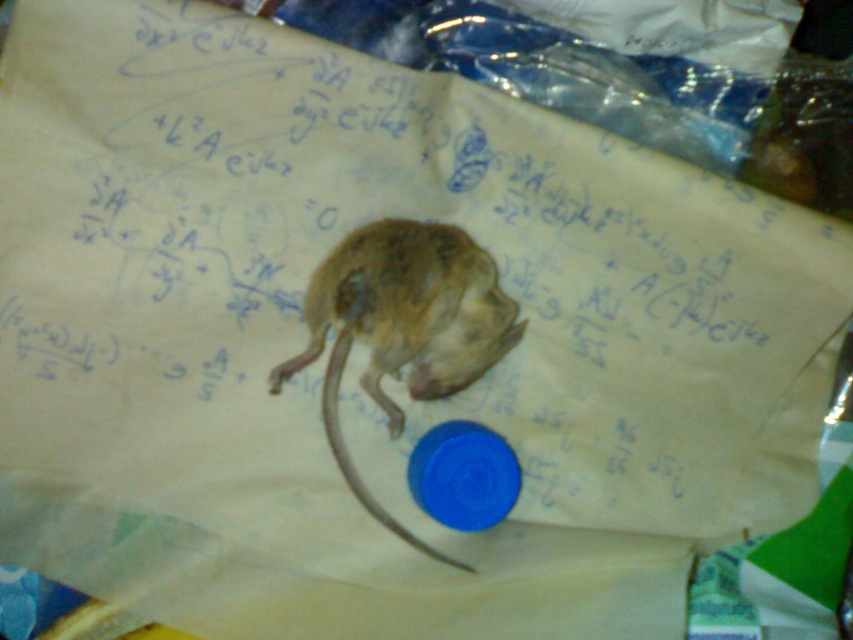
Between fuzzy brown mouse at center and brown fur tail at center, which one is positioned higher?

fuzzy brown mouse at center is above.

Which is in front, point (437, 387) or point (343, 342)?

Point (343, 342)

Where is `fuzzy brown mouse at center`? fuzzy brown mouse at center is located at coordinates (403, 326).